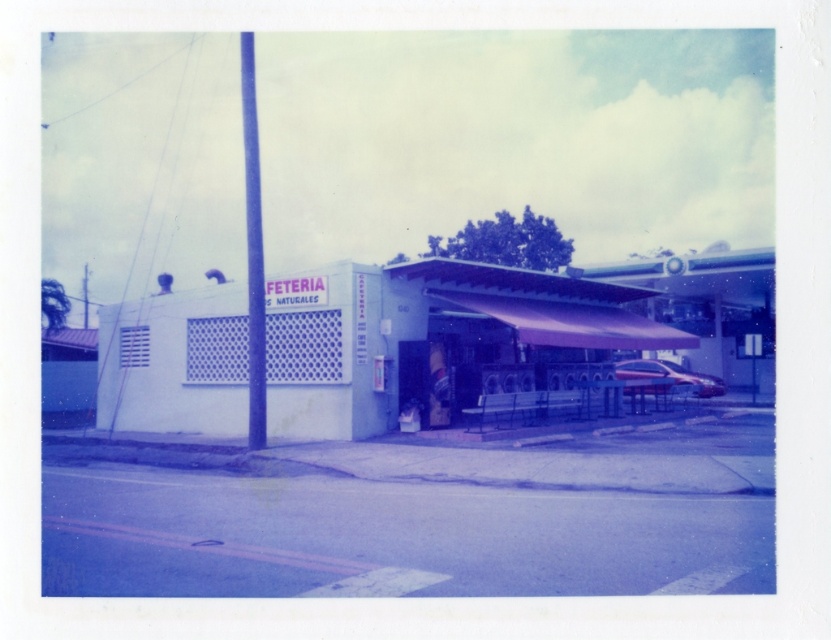
You are standing at the entrance of the FETERIA NATURALES building. You need to locate the smooth blue pole at center. According to the coordinates provided, where exactly would you find it?

The smooth blue pole at center is located at point [253,250].